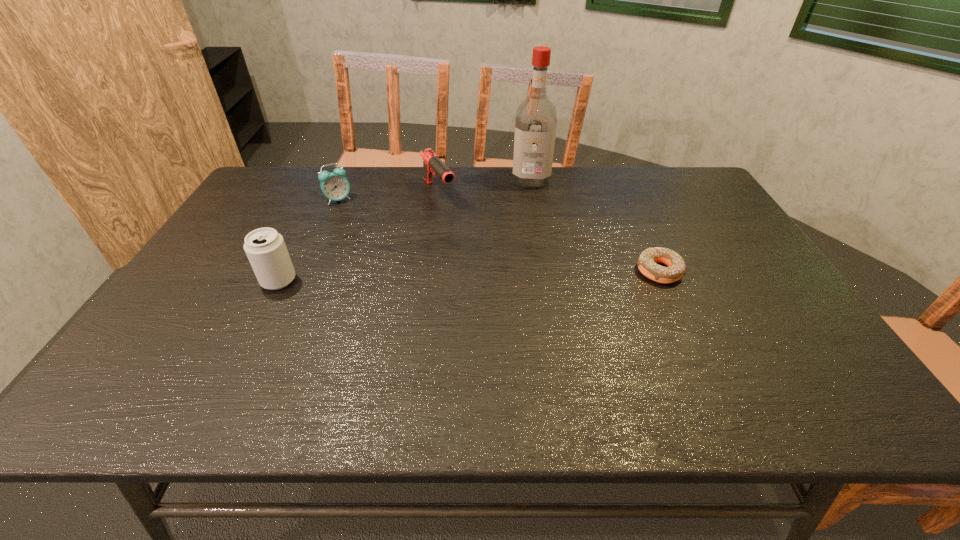
This screenshot has width=960, height=540. In order to click on vacant space that satisfies the following two spatial constraints: 1. on the back side of the can; 2. on the left side of the doughnut in this screenshot , I will do `click(283, 271)`.

Find the location of a particular element. The image size is (960, 540). free space in the image that satisfies the following two spatial constraints: 1. on the front side of the rightmost object; 2. on the right side of the gun is located at coordinates (428, 271).

What are the coordinates of `vacant point that satisfies the following two spatial constraints: 1. on the front side of the alarm clock; 2. on the right side of the shortest object` in the screenshot? It's located at (307, 271).